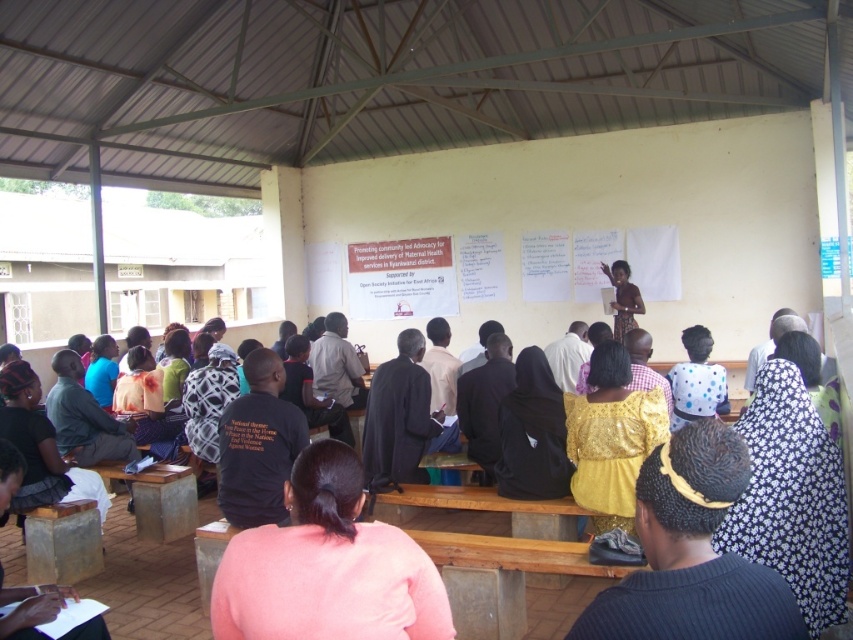
Question: Which point is closer to the camera?

Choices:
 (A) (630, 321)
 (B) (181, 356)
 (C) (792, 557)

Answer: (C)

Question: Among these objects, which one is farthest from the camera?

Choices:
 (A) plaid fabric shirt at center
 (B) shiny yellow blouse at center

Answer: (A)

Question: Is pink fabric at center thinner than shiny yellow blouse at center?

Choices:
 (A) yes
 (B) no

Answer: (B)

Question: Where is floral fabric dress at lower right located in relation to matte black shirt at center in the image?

Choices:
 (A) above
 (B) below

Answer: (B)

Question: Can you confirm if floral fabric dress at lower right is wider than plaid fabric shirt at center?

Choices:
 (A) no
 (B) yes

Answer: (B)

Question: Which of the following is the closest to the observer?

Choices:
 (A) (541, 380)
 (B) (225, 381)
 (C) (822, 493)

Answer: (C)